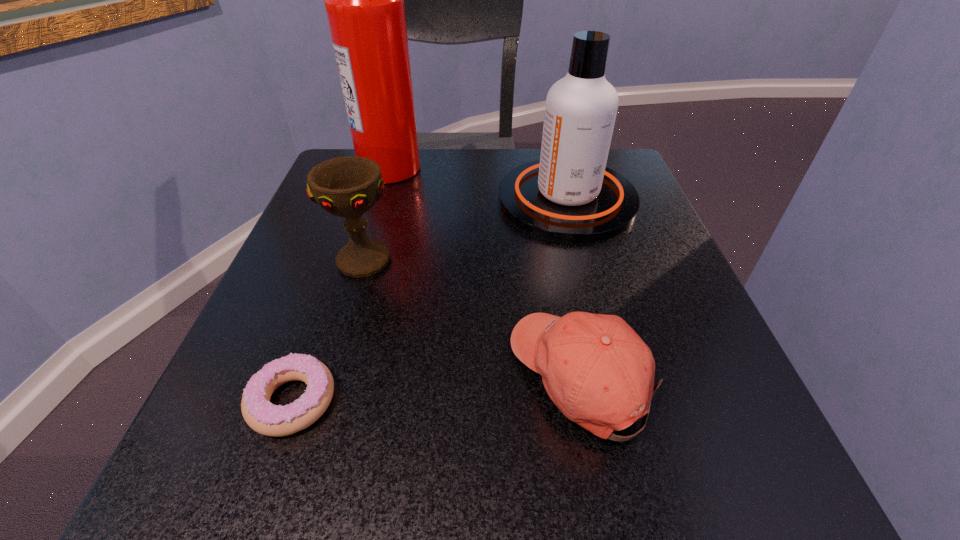
Identify the location of object that can be found as the closest to the shortest object. This screenshot has width=960, height=540. (349, 186).

At what (x,y) coordinates should I click in order to perform the action: click on vacant region that satisfies the following two spatial constraints: 1. at the nozzle of the tallest object; 2. on the front side of the shortest object. Please return your answer as a coordinate pair (x, y). This screenshot has height=540, width=960. Looking at the image, I should click on (322, 401).

This screenshot has height=540, width=960. I want to click on free space that satisfies the following two spatial constraints: 1. at the nozzle of the tallest object; 2. on the left side of the chalice, so click(x=363, y=260).

Find the location of a particular element. The height and width of the screenshot is (540, 960). vacant space that satisfies the following two spatial constraints: 1. at the nozzle of the fourth tallest object; 2. on the right side of the tallest object is located at coordinates (328, 376).

The image size is (960, 540). Find the location of `blank area in the image that satisfies the following two spatial constraints: 1. at the nozzle of the fire extinguisher; 2. on the front side of the doughnut`. blank area in the image that satisfies the following two spatial constraints: 1. at the nozzle of the fire extinguisher; 2. on the front side of the doughnut is located at coordinates (322, 401).

I want to click on blank area in the image that satisfies the following two spatial constraints: 1. on the back side of the doughnut; 2. on the left side of the third shortest object, so click(342, 260).

At what (x,y) coordinates should I click in order to perform the action: click on blank space that satisfies the following two spatial constraints: 1. at the nozzle of the fire extinguisher; 2. on the back side of the cleansing agent. Please return your answer as a coordinate pair (x, y). The height and width of the screenshot is (540, 960). Looking at the image, I should click on (381, 200).

Image resolution: width=960 pixels, height=540 pixels. Identify the location of free location that satisfies the following two spatial constraints: 1. at the nozzle of the tallest object; 2. on the right side of the second shortest object. (328, 376).

At what (x,y) coordinates should I click in order to perform the action: click on vacant space that satisfies the following two spatial constraints: 1. at the nozzle of the fire extinguisher; 2. on the right side of the second shortest object. Please return your answer as a coordinate pair (x, y). Image resolution: width=960 pixels, height=540 pixels. Looking at the image, I should click on (328, 376).

Locate an element on the screen. vacant region that satisfies the following two spatial constraints: 1. at the nozzle of the baseball cap; 2. on the left side of the tallest object is located at coordinates (328, 376).